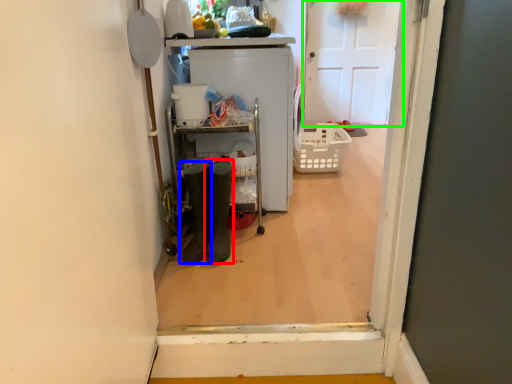
Question: Considering the real-world distances, which object is farthest from footwear (highlighted by a red box)? footwear (highlighted by a blue box) or door (highlighted by a green box)?

Choices:
 (A) footwear
 (B) door

Answer: (B)